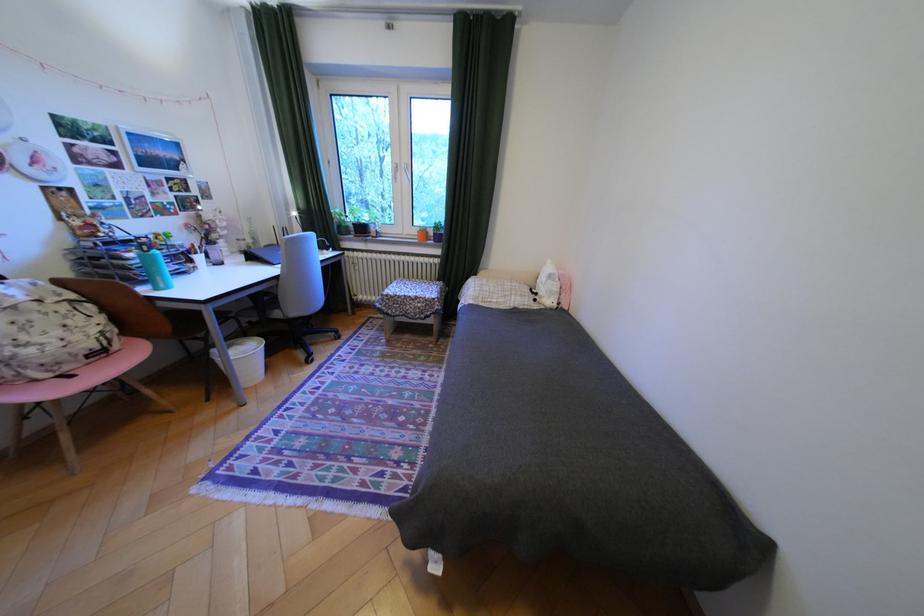
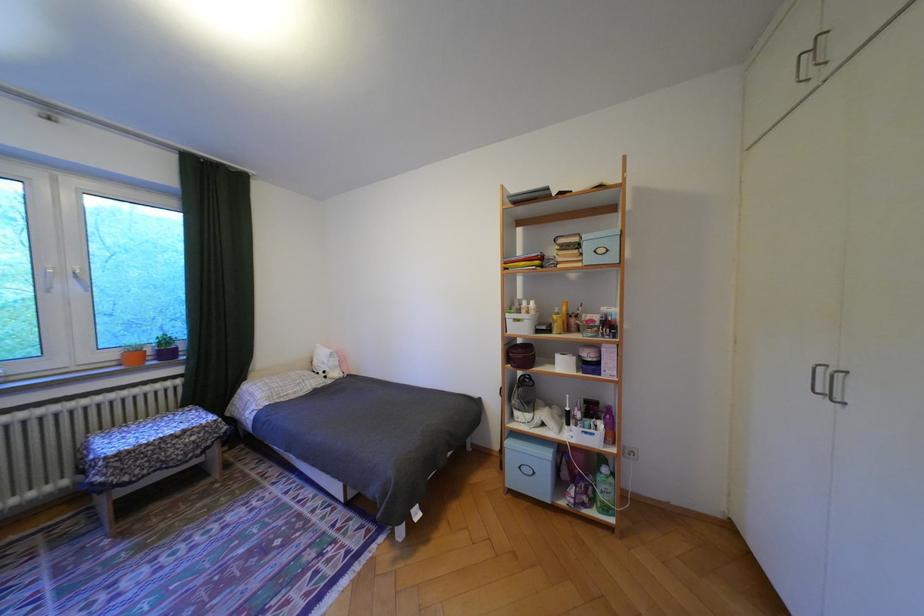
Locate, in the second image, the point that corresponds to point (450, 238) in the first image.

(178, 354)